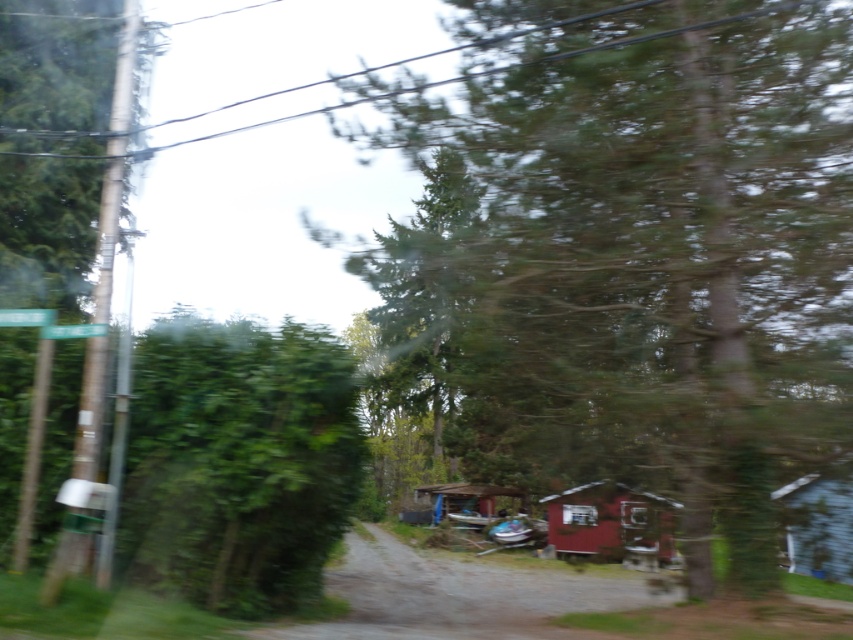
Question: Among these objects, which one is nearest to the camera?

Choices:
 (A) transparent glass car window at center
 (B) wooden cabin at right
 (C) brown rough wooden pole at left

Answer: (C)

Question: Is green leafy tree at left closer to camera compared to transparent glass car window at center?

Choices:
 (A) no
 (B) yes

Answer: (B)

Question: Which of the following is the farthest from the observer?

Choices:
 (A) clear glass car window at center
 (B) green plastic street sign at upper left
 (C) green leafy tree at left

Answer: (A)

Question: Does brown rough wooden pole at left come behind green plastic sign at upper left?

Choices:
 (A) yes
 (B) no

Answer: (B)

Question: Can you confirm if brown rough wooden pole at left is smaller than wooden cabin at center?

Choices:
 (A) no
 (B) yes

Answer: (A)

Question: Which object appears farthest from the camera in this image?

Choices:
 (A) green plastic sign at upper left
 (B) green plastic street sign at upper left
 (C) green textured tree at center
 (D) wooden cabin at right

Answer: (D)